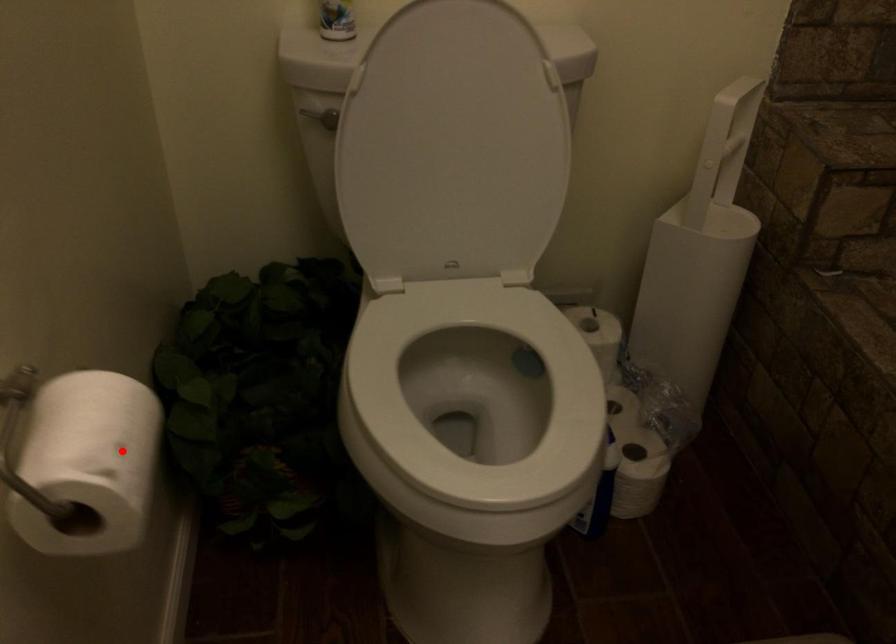
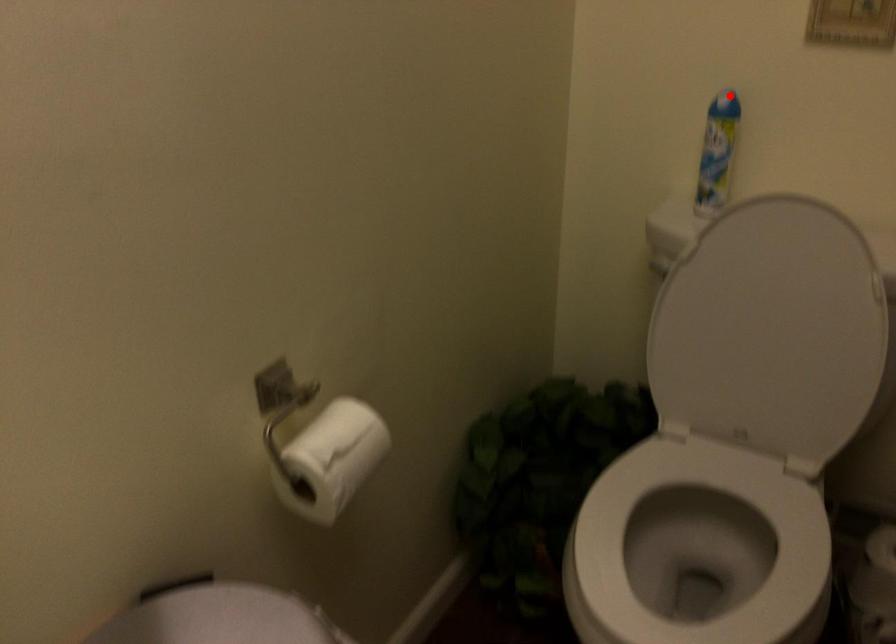
I am providing you with two images of the same scene from different viewpoints. A red point is marked on the first image and another point is marked on the second image. Do the highlighted points in image1 and image2 indicate the same real-world spot?

No